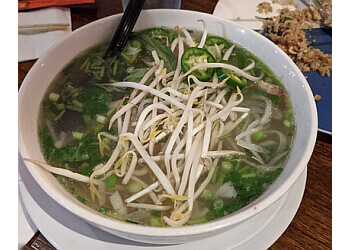
Locate an element on the screen. spoon is located at coordinates (122, 27).